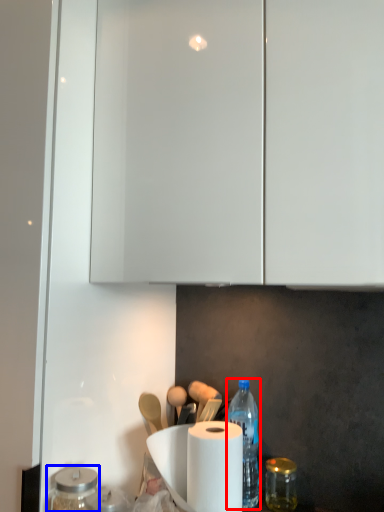
Question: Among these objects, which one is farthest to the camera, bottle (highlighted by a red box) or glass jar (highlighted by a blue box)?

Choices:
 (A) bottle
 (B) glass jar

Answer: (A)